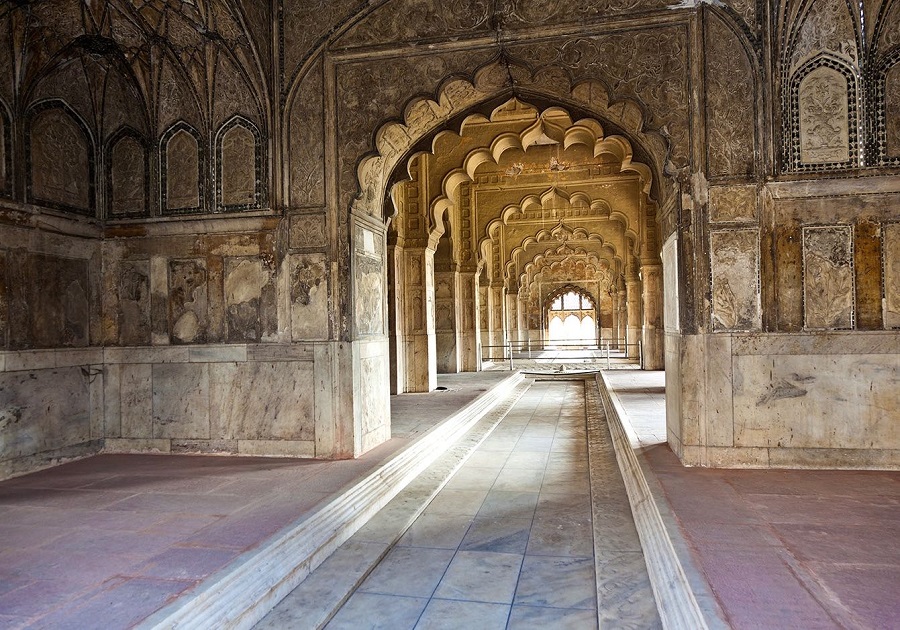
Where is `stone floor`? The width and height of the screenshot is (900, 630). stone floor is located at coordinates (495, 495).